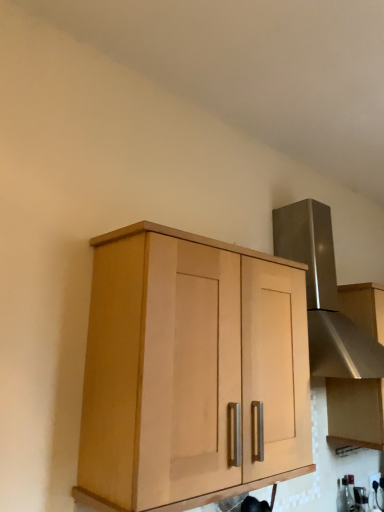
Question: Can you confirm if satin silver vent at upper right is positioned to the left of clear glass bottle at lower right?

Choices:
 (A) no
 (B) yes

Answer: (B)

Question: Can we say satin silver vent at upper right lies outside clear glass bottle at lower right?

Choices:
 (A) no
 (B) yes

Answer: (B)

Question: From the image's perspective, is satin silver vent at upper right located beneath clear glass bottle at lower right?

Choices:
 (A) no
 (B) yes

Answer: (A)

Question: Is satin silver vent at upper right thinner than clear glass bottle at lower right?

Choices:
 (A) yes
 (B) no

Answer: (B)

Question: From the image's perspective, is satin silver vent at upper right over clear glass bottle at lower right?

Choices:
 (A) yes
 (B) no

Answer: (A)

Question: From a real-world perspective, is satin silver vent at upper right positioned under clear glass bottle at lower right based on gravity?

Choices:
 (A) no
 (B) yes

Answer: (A)

Question: Is light wood cabinet at center, the first cabinetry from the front, surrounded by satin silver hood at upper right, arranged as the second cabinetry when viewed from the front?

Choices:
 (A) no
 (B) yes

Answer: (A)

Question: From a real-world perspective, is satin silver hood at upper right, arranged as the second cabinetry when viewed from the front, below light wood cabinet at center, the first cabinetry from the front?

Choices:
 (A) no
 (B) yes

Answer: (A)

Question: Is satin silver hood at upper right, which is the 1th cabinetry in right-to-left order, smaller than light wood cabinet at center, the first cabinetry from the front?

Choices:
 (A) yes
 (B) no

Answer: (A)

Question: From a real-world perspective, does satin silver hood at upper right, which is the 1th cabinetry in right-to-left order, stand above light wood cabinet at center, marked as the first cabinetry in a left-to-right arrangement?

Choices:
 (A) yes
 (B) no

Answer: (A)

Question: Is satin silver hood at upper right, placed as the second cabinetry when sorted from left to right, closer to camera compared to light wood cabinet at center, placed as the second cabinetry when sorted from right to left?

Choices:
 (A) yes
 (B) no

Answer: (B)

Question: From the image's perspective, is satin silver hood at upper right, arranged as the second cabinetry when viewed from the front, under light wood cabinet at center, marked as the first cabinetry in a left-to-right arrangement?

Choices:
 (A) yes
 (B) no

Answer: (A)

Question: Is satin silver hood at upper right, placed as the second cabinetry when sorted from left to right, a part of light wood cabinet at center, placed as the second cabinetry when sorted from right to left?

Choices:
 (A) no
 (B) yes

Answer: (A)